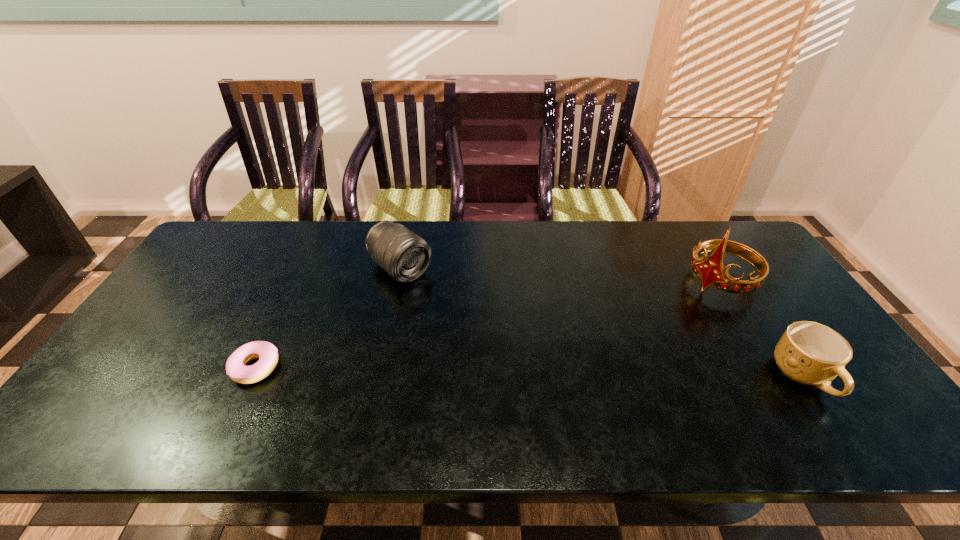
Where is `vacant space located on the surface of the telephoto lens`? This screenshot has height=540, width=960. vacant space located on the surface of the telephoto lens is located at coordinates (471, 326).

Image resolution: width=960 pixels, height=540 pixels. I want to click on free space located 0.140m on the surface of the telephoto lens, so click(x=450, y=308).

Locate an element on the screen. Image resolution: width=960 pixels, height=540 pixels. free space located on the surface of the telephoto lens is located at coordinates (514, 360).

Identify the location of tiara at the far edge. This screenshot has height=540, width=960. (710, 271).

This screenshot has height=540, width=960. Find the location of `telephoto lens at the far edge`. telephoto lens at the far edge is located at coordinates (405, 256).

This screenshot has height=540, width=960. I want to click on doughnut that is at the near edge, so click(x=267, y=353).

The image size is (960, 540). In order to click on mug at the near edge in this screenshot , I will do `click(810, 353)`.

Locate an element on the screen. The height and width of the screenshot is (540, 960). mug that is at the right edge is located at coordinates (810, 353).

Locate an element on the screen. The height and width of the screenshot is (540, 960). tiara located in the right edge section of the desktop is located at coordinates (710, 271).

Locate an element on the screen. The width and height of the screenshot is (960, 540). object that is at the far right corner is located at coordinates (710, 271).